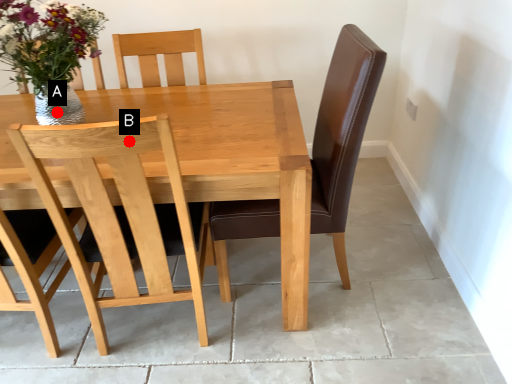
Question: Two points are circled on the image, labeled by A and B beside each circle. Among these points, which one is farthest from the camera?

Choices:
 (A) A is further
 (B) B is further

Answer: (A)